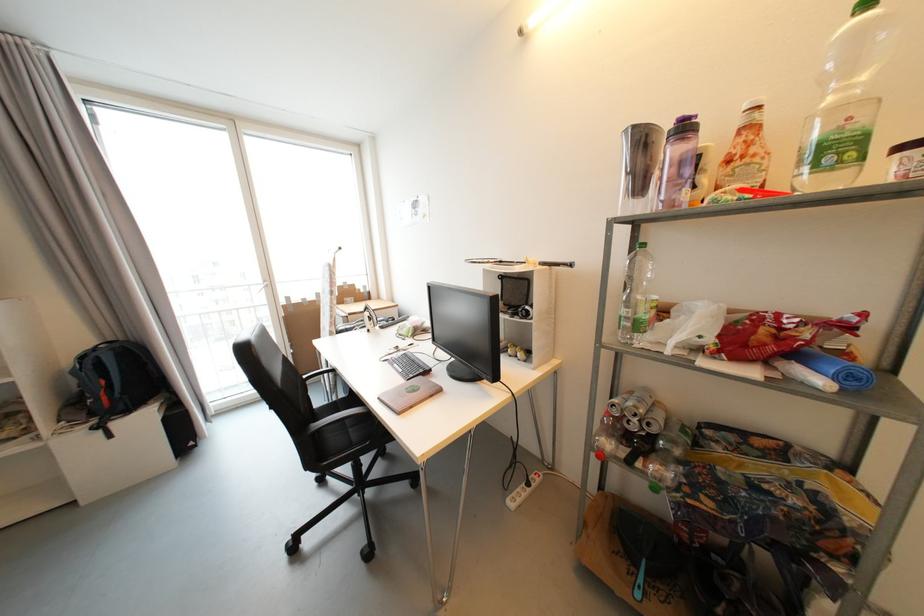
Locate an element on the screen. Image resolution: width=924 pixels, height=616 pixels. large plastic bottle is located at coordinates (844, 103).